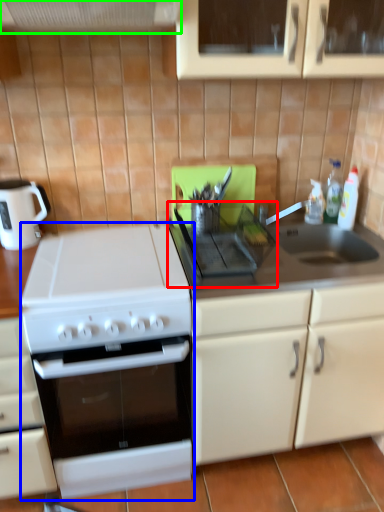
Question: Which is nearer to the gas stove (highlighted by a red box)? gas stove (highlighted by a blue box) or exhaust hood (highlighted by a green box).

Choices:
 (A) gas stove
 (B) exhaust hood

Answer: (A)